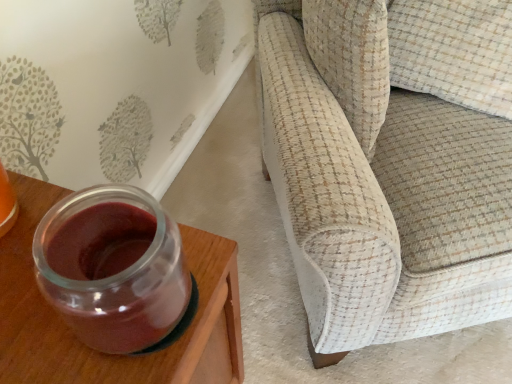
Question: Is point (225, 256) closer or farther from the camera than point (415, 215)?

Choices:
 (A) farther
 (B) closer

Answer: (B)

Question: Relative to textured beige fabric couch at right, is transparent glass jar at left in front or behind?

Choices:
 (A) front
 (B) behind

Answer: (A)

Question: Considering the positions of transparent glass jar at left and textured beige fabric couch at right in the image, is transparent glass jar at left taller or shorter than textured beige fabric couch at right?

Choices:
 (A) short
 (B) tall

Answer: (A)

Question: Is point (419, 94) positioned closer to the camera than point (30, 291)?

Choices:
 (A) closer
 (B) farther

Answer: (B)

Question: From a real-world perspective, is textured beige fabric couch at right positioned above or below transparent glass jar at left?

Choices:
 (A) above
 (B) below

Answer: (B)

Question: Considering the positions of textured beige fabric couch at right and transparent glass jar at left in the image, is textured beige fabric couch at right taller or shorter than transparent glass jar at left?

Choices:
 (A) short
 (B) tall

Answer: (B)

Question: Is textured beige fabric couch at right wider or thinner than transparent glass jar at left?

Choices:
 (A) wide
 (B) thin

Answer: (A)